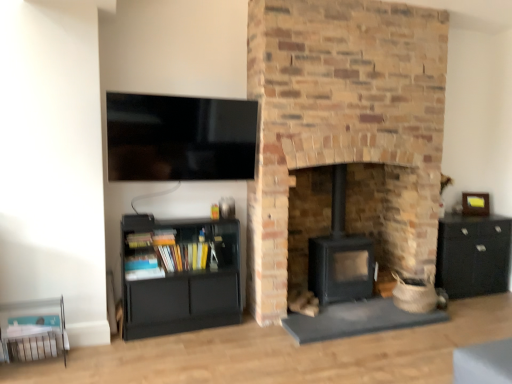
Locate an element on the screen. The width and height of the screenshot is (512, 384). free space on the front side of matte black bookshelf at lower left is located at coordinates (168, 351).